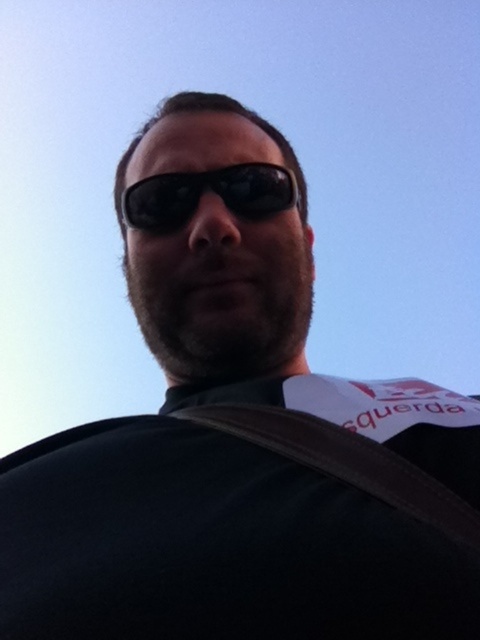
Is point (468, 545) behind point (175, 180)?

No, it is in front of (175, 180).

Which is behind, point (403, 513) or point (294, 186)?

Point (294, 186)

This screenshot has height=640, width=480. I want to click on brown leather strap at lower center, so click(348, 461).